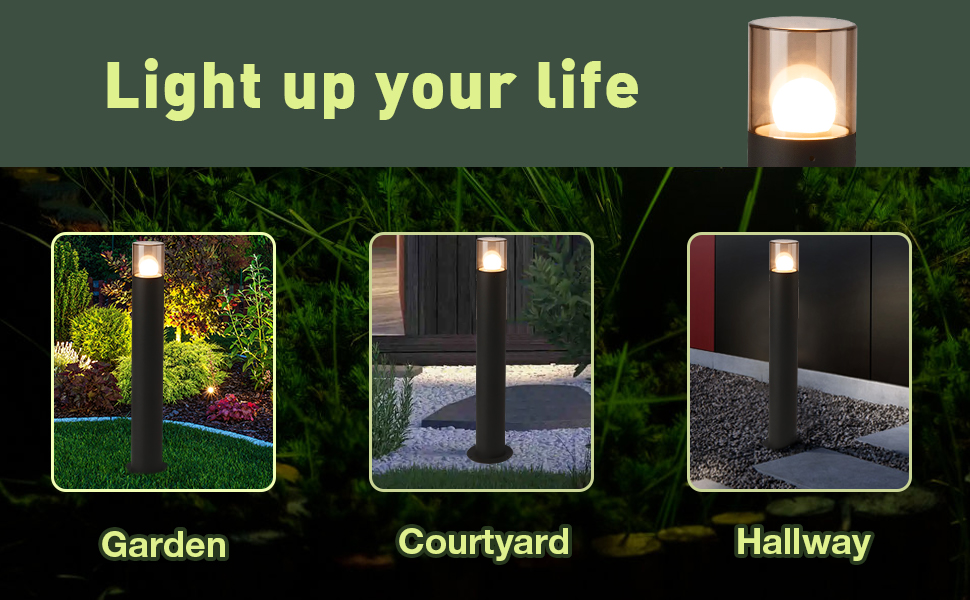
The height and width of the screenshot is (600, 970). What are the coordinates of `"light"` in the screenshot? It's located at (188, 75).